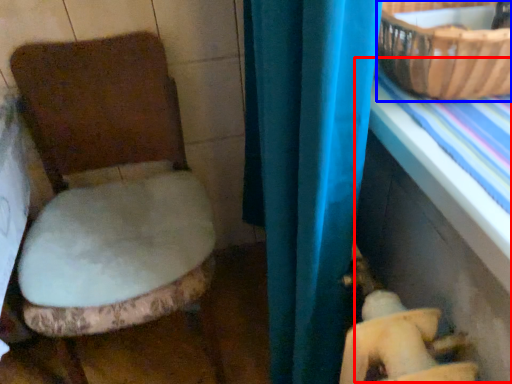
Question: Which point is closer to the camera, table (highlighted by a red box) or basket (highlighted by a blue box)?

Choices:
 (A) table
 (B) basket

Answer: (A)